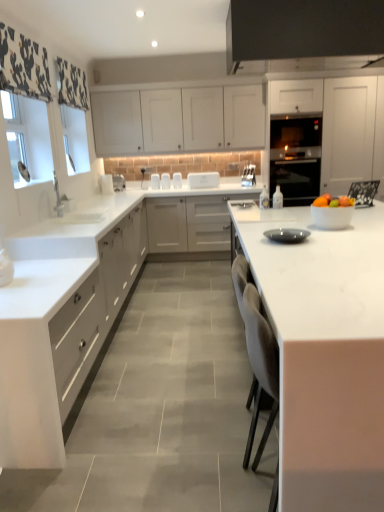
Image resolution: width=384 pixels, height=512 pixels. I want to click on black matte exhaust hood at upper center, so click(x=303, y=35).

Where is `white marble countertop at center, the first countertop when ordered from right to left`? Image resolution: width=384 pixels, height=512 pixels. white marble countertop at center, the first countertop when ordered from right to left is located at coordinates coord(324,353).

Measure the distance between matte gray plate at center, positioned as the second appliance in back-to-front order, and camera.

The distance of matte gray plate at center, positioned as the second appliance in back-to-front order, from camera is 2.34 meters.

Identify the location of black matte exhaust hood at upper center. (303, 35).

Is point (288, 168) more distant than point (31, 293)?

Yes, it is.

Does black glass oven at center appear on the left side of white marble countertop at center, acting as the first countertop starting from the left?

No, black glass oven at center is not to the left of white marble countertop at center, acting as the first countertop starting from the left.

Does black glass oven at center have a greater height compared to white marble countertop at center, acting as the first countertop starting from the left?

In fact, black glass oven at center may be shorter than white marble countertop at center, acting as the first countertop starting from the left.

In the scene shown: What's the angular difference between black glass oven at center and white marble countertop at center, acting as the 2th countertop starting from the right,'s facing directions?

The facing directions of black glass oven at center and white marble countertop at center, acting as the 2th countertop starting from the right, are 92.3 degrees apart.

From the image's perspective, between black matte exhaust hood at upper center and white glass window screen at left, which one is located above?

From the image's view, black matte exhaust hood at upper center is above.

How different are the orientations of black matte exhaust hood at upper center and white glass window screen at left in degrees?

There is a 89.5-degree angle between the facing directions of black matte exhaust hood at upper center and white glass window screen at left.

Is black matte exhaust hood at upper center bigger or smaller than white glass window screen at left?

Clearly, black matte exhaust hood at upper center is larger in size than white glass window screen at left.

From the image's perspective, is white matte cabinet at center, marked as the second cabinetry in a right-to-left arrangement, on top of white matte cabinet at upper center, placed as the third cabinetry when sorted from right to left?

Actually, white matte cabinet at center, marked as the second cabinetry in a right-to-left arrangement, appears below white matte cabinet at upper center, placed as the third cabinetry when sorted from right to left, in the image.

Is white matte cabinet at center, marked as the second cabinetry in a right-to-left arrangement, turned away from white matte cabinet at upper center, placed as the third cabinetry when sorted from right to left?

No.

Considering the sizes of white matte cabinet at center, marked as the 3th cabinetry in a left-to-right arrangement, and white matte cabinet at upper center, the second cabinetry when ordered from left to right, in the image, is white matte cabinet at center, marked as the 3th cabinetry in a left-to-right arrangement, wider or thinner than white matte cabinet at upper center, the second cabinetry when ordered from left to right,?

Considering their sizes, white matte cabinet at center, marked as the 3th cabinetry in a left-to-right arrangement, looks broader than white matte cabinet at upper center, the second cabinetry when ordered from left to right.

Is white matte cabinet at center, marked as the second cabinetry in a right-to-left arrangement, at the left side of white matte cabinet at right, placed as the first cabinetry when sorted from right to left?

Correct, you'll find white matte cabinet at center, marked as the second cabinetry in a right-to-left arrangement, to the left of white matte cabinet at right, placed as the first cabinetry when sorted from right to left.

The height and width of the screenshot is (512, 384). I want to click on the 1st cabinetry above the white matte cabinet at center, marked as the 3th cabinetry in a left-to-right arrangement (from the image's perspective), so click(x=325, y=135).

From a real-world perspective, is white matte cabinet at center, marked as the second cabinetry in a right-to-left arrangement, positioned over white matte cabinet at right, the fourth cabinetry positioned from the left, based on gravity?

No, from a real-world perspective, white matte cabinet at center, marked as the second cabinetry in a right-to-left arrangement, is not over white matte cabinet at right, the fourth cabinetry positioned from the left

Consider the image. Is white matte cabinet at center, marked as the 3th cabinetry in a left-to-right arrangement, beside white matte cabinet at right, placed as the first cabinetry when sorted from right to left?

No, white matte cabinet at center, marked as the 3th cabinetry in a left-to-right arrangement, is not next to white matte cabinet at right, placed as the first cabinetry when sorted from right to left.

Are black matte exhaust hood at upper center and matte gray plate at center, the first appliance from the right, making contact?

No, black matte exhaust hood at upper center is not in contact with matte gray plate at center, the first appliance from the right.

Measure the distance between black matte exhaust hood at upper center and matte gray plate at center, positioned as the second appliance in back-to-front order.

black matte exhaust hood at upper center is 5.50 feet from matte gray plate at center, positioned as the second appliance in back-to-front order.

Considering the sizes of black matte exhaust hood at upper center and matte gray plate at center, which is the first appliance from front to back, in the image, is black matte exhaust hood at upper center taller or shorter than matte gray plate at center, which is the first appliance from front to back,?

black matte exhaust hood at upper center is taller than matte gray plate at center, which is the first appliance from front to back.

Could you tell me if black matte exhaust hood at upper center is turned towards matte gray plate at center, the first appliance from the right?

No, black matte exhaust hood at upper center is not facing towards matte gray plate at center, the first appliance from the right.

What's the angular difference between white marble countertop at center, acting as the 2th countertop starting from the right, and white matte cabinet at right, placed as the first cabinetry when sorted from right to left,'s facing directions?

90.2 degrees.

Which of these two, white marble countertop at center, acting as the 2th countertop starting from the right, or white matte cabinet at right, placed as the first cabinetry when sorted from right to left, stands shorter?

Standing shorter between the two is white marble countertop at center, acting as the 2th countertop starting from the right.

Considering the positions of points (77, 266) and (354, 124), is point (77, 266) closer to camera compared to point (354, 124)?

Yes, point (77, 266) is closer to viewer.

Is white marble countertop at center, acting as the first countertop starting from the left, turned away from white matte cabinet at right, the fourth cabinetry positioned from the left?

white marble countertop at center, acting as the first countertop starting from the left, does not have its back to white matte cabinet at right, the fourth cabinetry positioned from the left.

Is white matte cabinet at left, the first cabinetry positioned from the left, looking in the opposite direction of white marble countertop at center, the first countertop when ordered from right to left?

That's not correct — white matte cabinet at left, the first cabinetry positioned from the left, is not looking away from white marble countertop at center, the first countertop when ordered from right to left.

Which point is more forward, [103,257] or [288,260]?

The point [288,260] is closer to the camera.

In the scene shown: Is white matte cabinet at left, the first cabinetry positioned from the left, taller than white marble countertop at center, the first countertop when ordered from right to left?

No.

Consider the image. Between white matte cabinet at left, the fourth cabinetry in the right-to-left sequence, and white marble countertop at center, the second countertop positioned from the left, which one has larger width?

With larger width is white marble countertop at center, the second countertop positioned from the left.

What are the coordinates of `the 2nd countertop counting from the left side of the black glass oven at center` in the screenshot? It's located at (84, 245).

This screenshot has height=512, width=384. I want to click on window screen behind the black matte exhaust hood at upper center, so (x=28, y=138).

Estimate the real-world distances between objects in this image. Which object is closer to white matte cabinet at center, marked as the second cabinetry in a right-to-left arrangement, white matte cabinet at left, the first cabinetry positioned from the left, or black glass oven at center?

white matte cabinet at left, the first cabinetry positioned from the left.

Considering their positions, is white matte cabinet at upper center, placed as the third cabinetry when sorted from right to left, positioned further to white matte cabinet at right, the fourth cabinetry positioned from the left, than black glass oven at center?

white matte cabinet at upper center, placed as the third cabinetry when sorted from right to left, is positioned further to the anchor white matte cabinet at right, the fourth cabinetry positioned from the left.

When comparing their distances from white matte cabinet at center, marked as the second cabinetry in a right-to-left arrangement, does matte gray plate at center, which is the first appliance from front to back, or black glass oven at center seem closer?

black glass oven at center.

Based on their spatial positions, is white glossy bowl at right or white marble countertop at center, the first countertop when ordered from right to left, closer to matte gray plate at center, marked as the second appliance in a top-to-bottom arrangement?

white glossy bowl at right lies closer to matte gray plate at center, marked as the second appliance in a top-to-bottom arrangement, than the other object.

Which object lies nearer to the anchor point white matte cabinet at upper center, the second cabinetry when ordered from left to right, white glossy bowl at right or white matte cabinet at center, marked as the 3th cabinetry in a left-to-right arrangement?

white matte cabinet at center, marked as the 3th cabinetry in a left-to-right arrangement.

Estimate the real-world distances between objects in this image. Which object is further from white glossy bowl at right, black matte exhaust hood at upper center or matte gray plate at center, positioned as the second appliance in back-to-front order?

black matte exhaust hood at upper center is further to white glossy bowl at right.

Based on the photo, which object lies nearer to the anchor point white matte cabinet at center, marked as the 3th cabinetry in a left-to-right arrangement, white marble countertop at center, acting as the 2th countertop starting from the right, or white marble countertop at center, the first countertop when ordered from right to left?

white marble countertop at center, acting as the 2th countertop starting from the right, is positioned closer to the anchor white matte cabinet at center, marked as the 3th cabinetry in a left-to-right arrangement.

Considering their positions, is matte gray plate at center, positioned as the second appliance in back-to-front order, positioned closer to white matte cabinet at center, marked as the 3th cabinetry in a left-to-right arrangement, than white matte cabinet at left, the first cabinetry positioned from the left?

Based on the image, white matte cabinet at left, the first cabinetry positioned from the left, appears to be nearer to white matte cabinet at center, marked as the 3th cabinetry in a left-to-right arrangement.

Find the location of a particular element. This screenshot has width=384, height=512. bowl between black matte exhaust hood at upper center and white marble countertop at center, acting as the 2th countertop starting from the right, in the up-down direction is located at coordinates (332, 217).

I want to click on window screen between white matte cabinet at left, the fourth cabinetry in the right-to-left sequence, and white matte cabinet at upper center, placed as the third cabinetry when sorted from right to left, in the front-back direction, so click(x=28, y=138).

Find the location of a particular element. Image resolution: width=384 pixels, height=512 pixels. bowl located between white glass window screen at left and white matte cabinet at right, the fourth cabinetry positioned from the left, in the left-right direction is located at coordinates (332, 217).

You are a GUI agent. You are given a task and a screenshot of the screen. Output one action in this format:
    pyautogui.click(x=<x>, y=<y>)
    Task: Click on the countertop between matte gray plate at center, marked as the second appliance in a top-to-bottom arrangement, and white matte cabinet at upper center, placed as the third cabinetry when sorted from right to left, from front to back
    Image resolution: width=384 pixels, height=512 pixels.
    Given the screenshot: What is the action you would take?
    pyautogui.click(x=84, y=245)